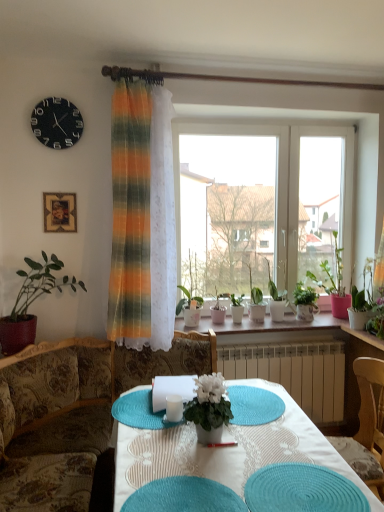
Find the location of a particular element. spots to the right of white matte flower pot at center, the fourth houseplant viewed from the right is located at coordinates (259, 433).